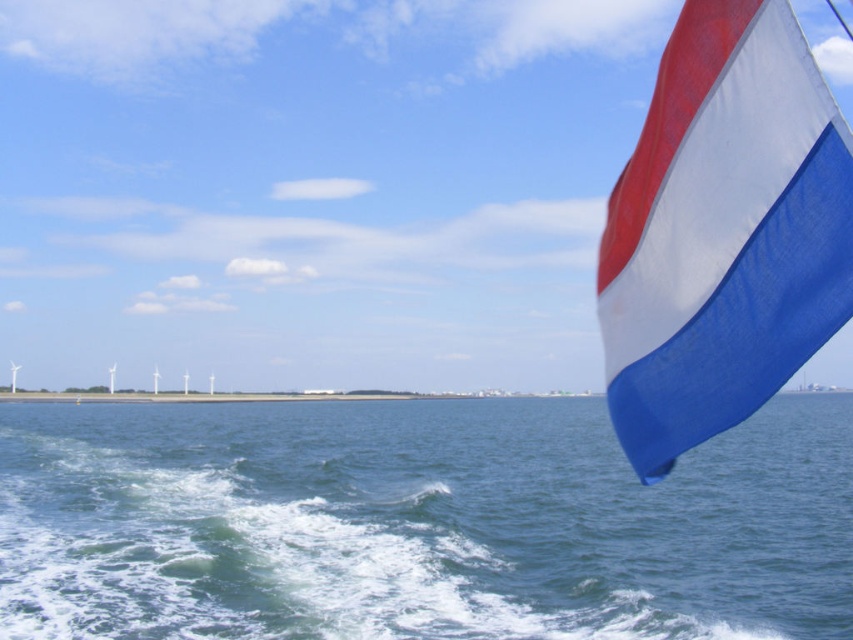
Find the location of `blue water at lower right`. blue water at lower right is located at coordinates (418, 522).

In order to click on blue water at lower right in this screenshot , I will do `click(418, 522)`.